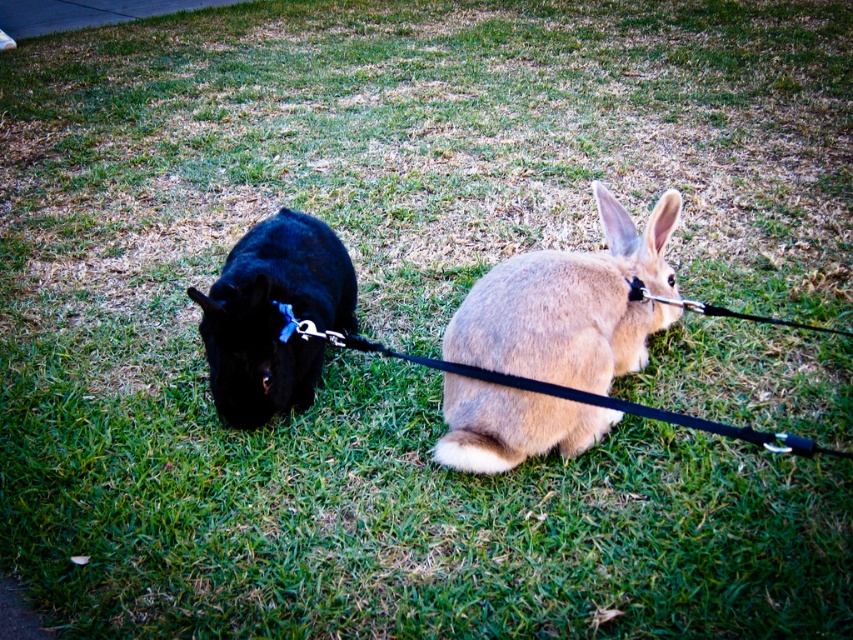
Question: Based on their relative distances, which object is nearer to the fuzzy beige rabbit at center?

Choices:
 (A) blue fabric neckband at center
 (B) black leather leash at center
 (C) shiny black rabbit at left

Answer: (B)

Question: Which of the following is the farthest from the observer?

Choices:
 (A) shiny black rabbit at left
 (B) blue fabric neckband at center

Answer: (B)

Question: Does fuzzy beige rabbit at center have a larger size compared to shiny black rabbit at left?

Choices:
 (A) yes
 (B) no

Answer: (A)

Question: Which object is positioned closest to the blue fabric neckband at center?

Choices:
 (A) shiny black rabbit at left
 (B) black leather leash at center

Answer: (A)

Question: Does fuzzy beige rabbit at center come behind shiny black rabbit at left?

Choices:
 (A) no
 (B) yes

Answer: (A)

Question: Does black leather leash at center lie behind blue fabric neckband at center?

Choices:
 (A) no
 (B) yes

Answer: (A)